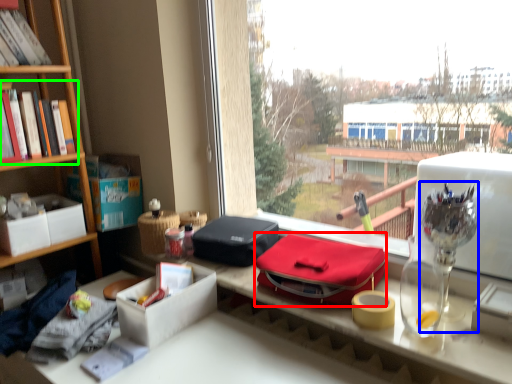
Question: Based on their relative distances, which object is nearer to lunch box (highlighted by a red box)? Choose from glass vase (highlighted by a blue box) and book (highlighted by a green box).

Choices:
 (A) glass vase
 (B) book

Answer: (A)